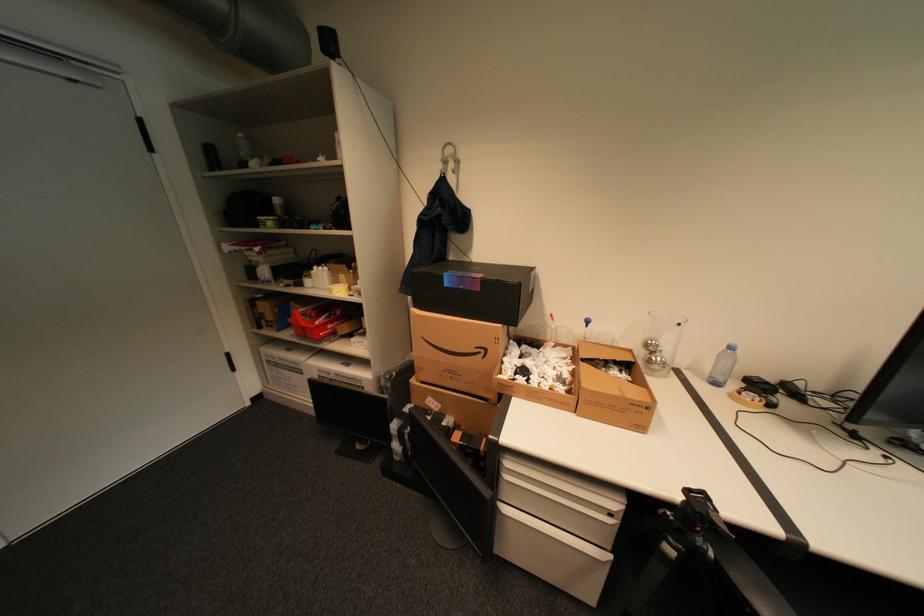
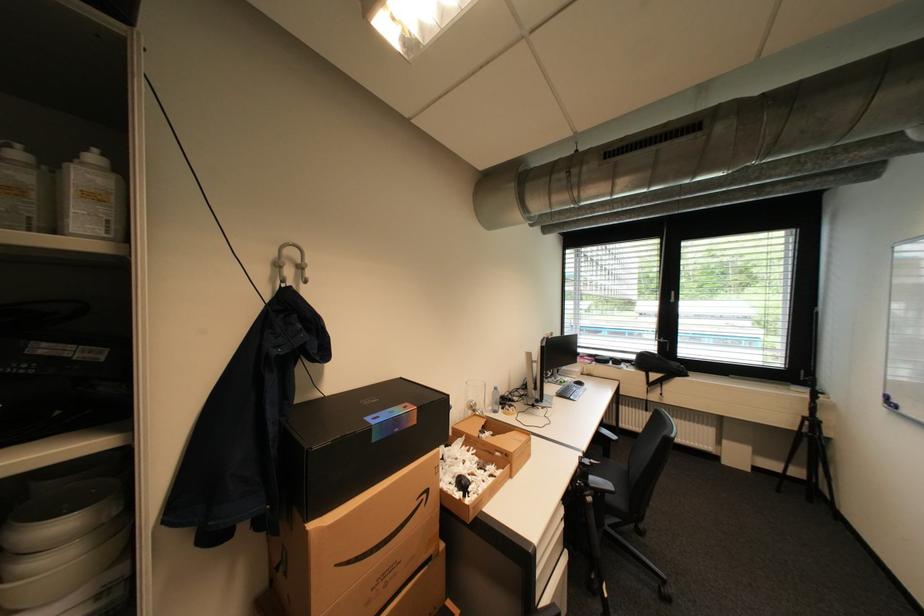
Find the pixel in the second image that matches point 492,352 in the first image.

(433, 496)